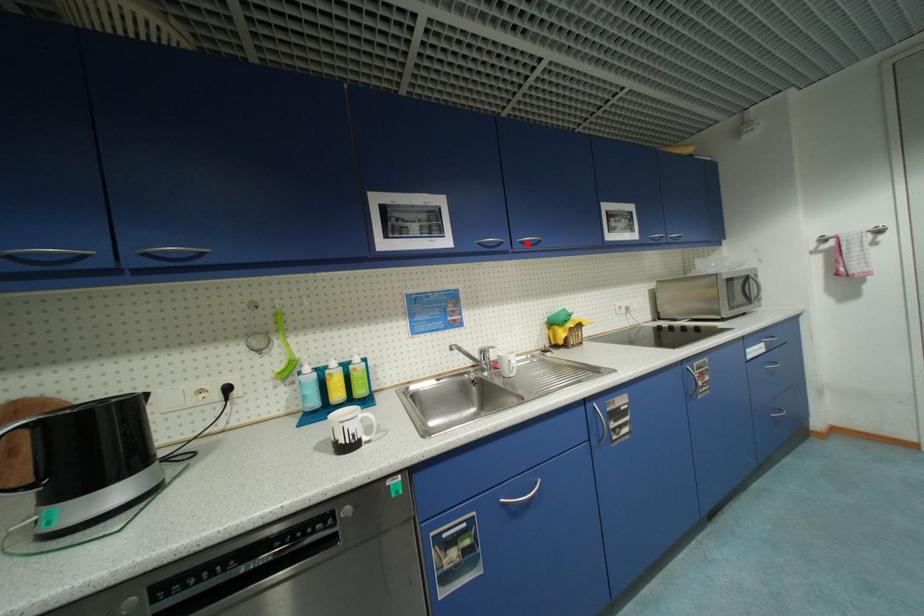
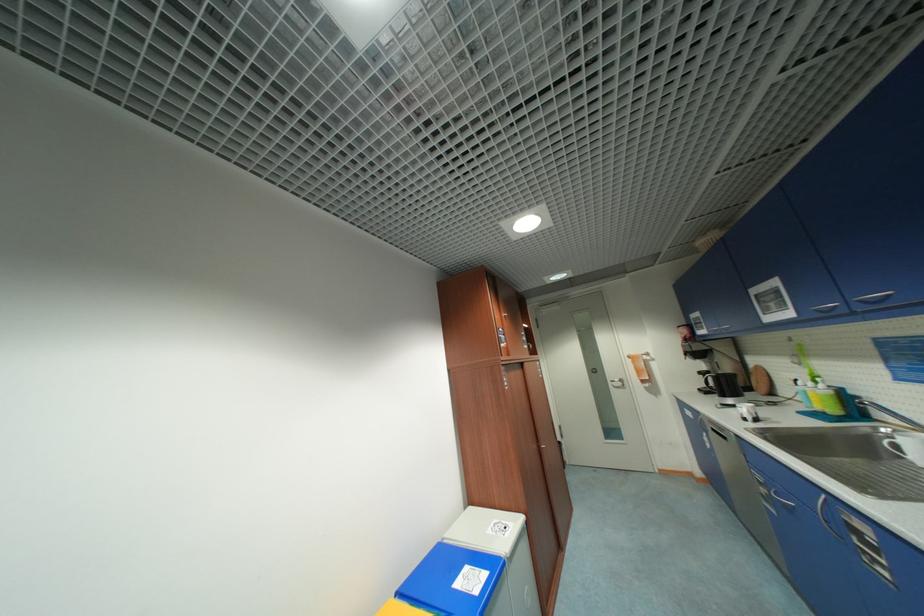
Find the pixel in the second image that matches the highlighted location in the first image.

(867, 302)